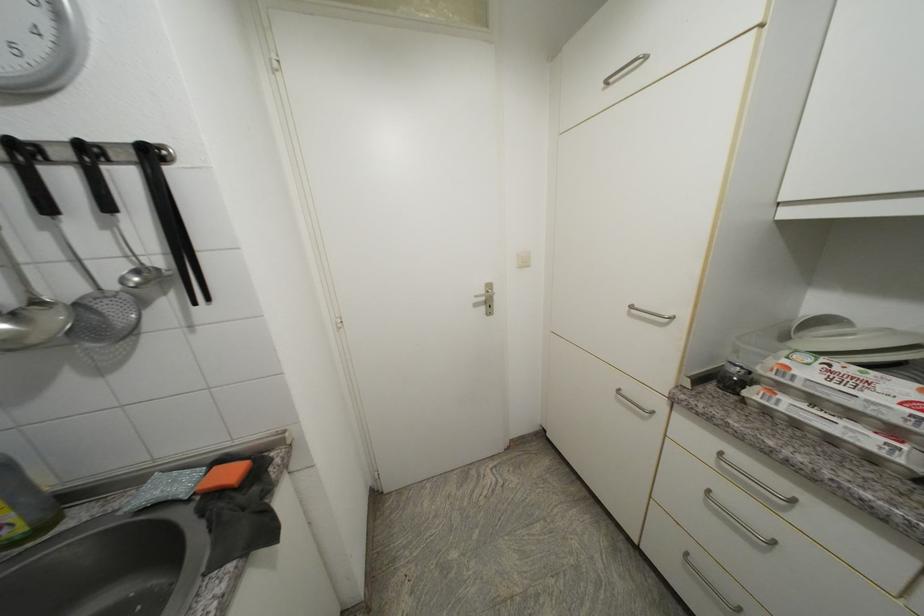
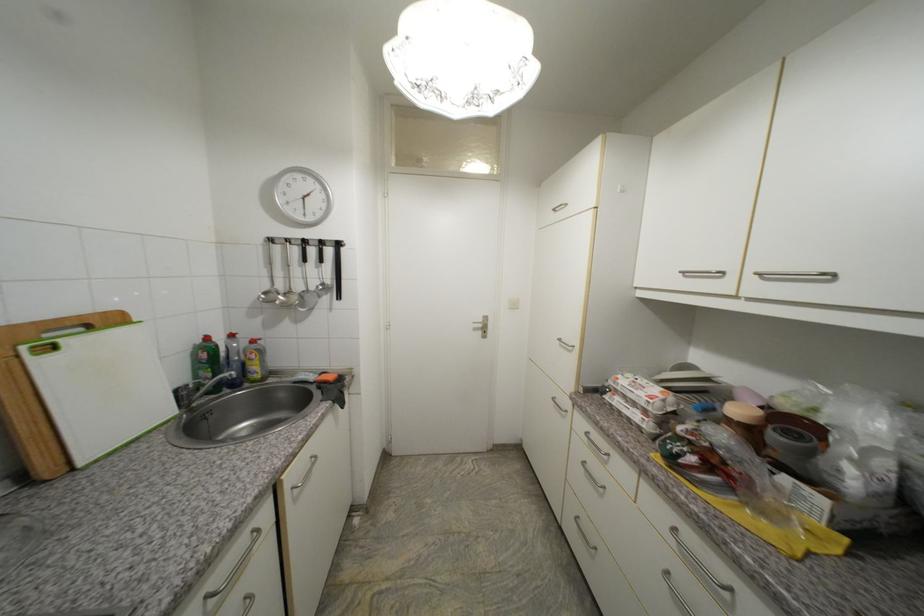
Question: I am providing you with two images of the same scene from different viewpoints. After the viewpoint changes to image2, which objects are now occluded?

Choices:
 (A) egg carton
 (B) wooden cutting board
 (C) green soap bottle
 (D) none of these

Answer: (D)